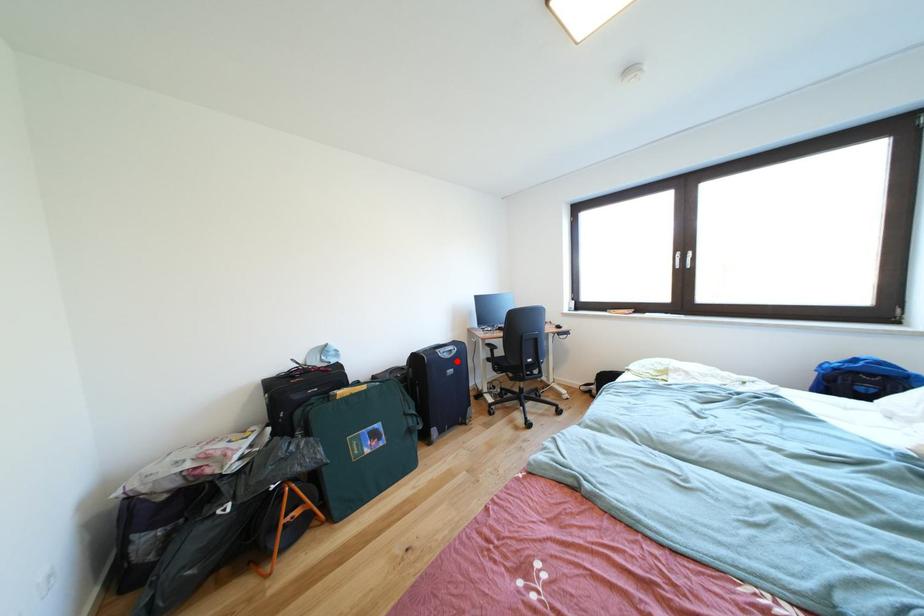
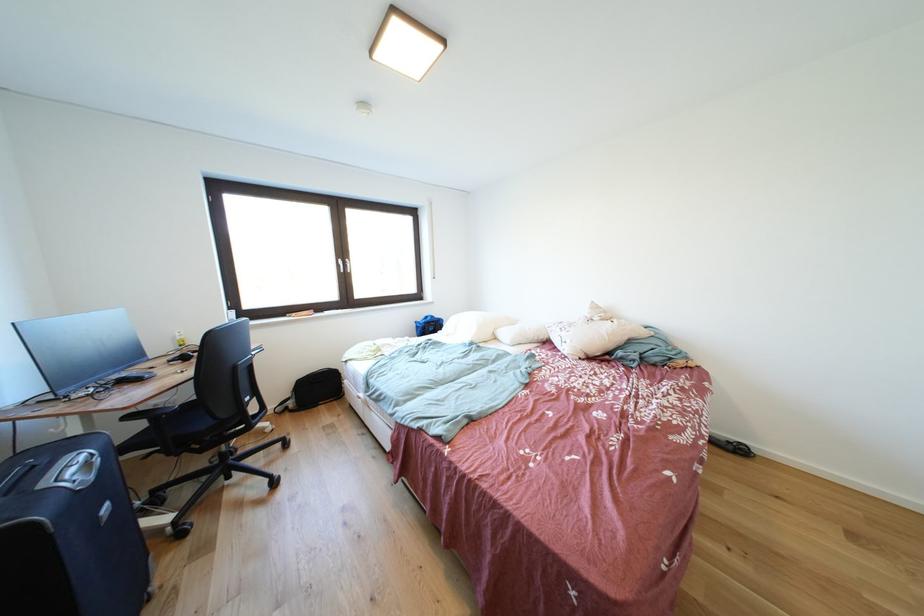
The point at the highlighted location is marked in the first image. Where is the corresponding point in the second image?

(101, 483)